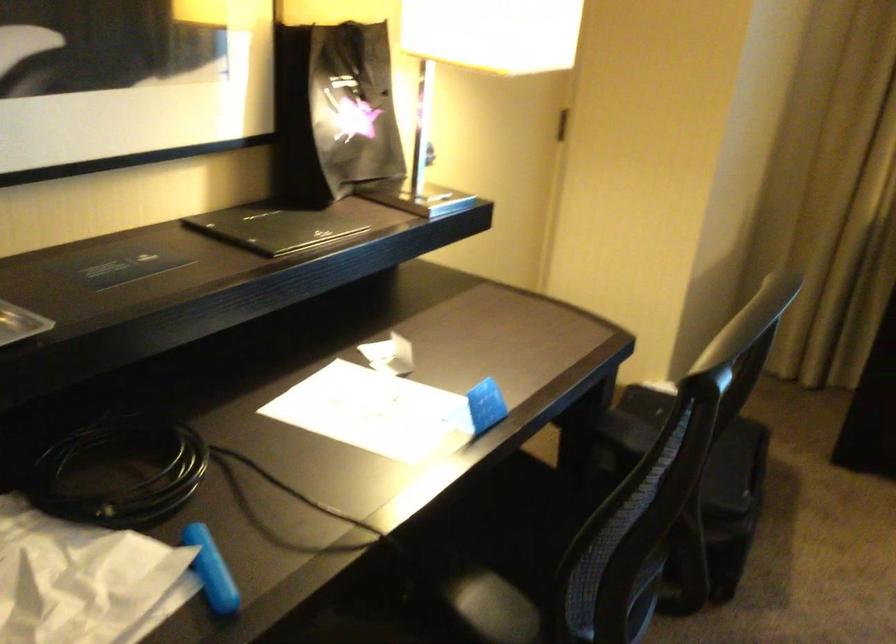
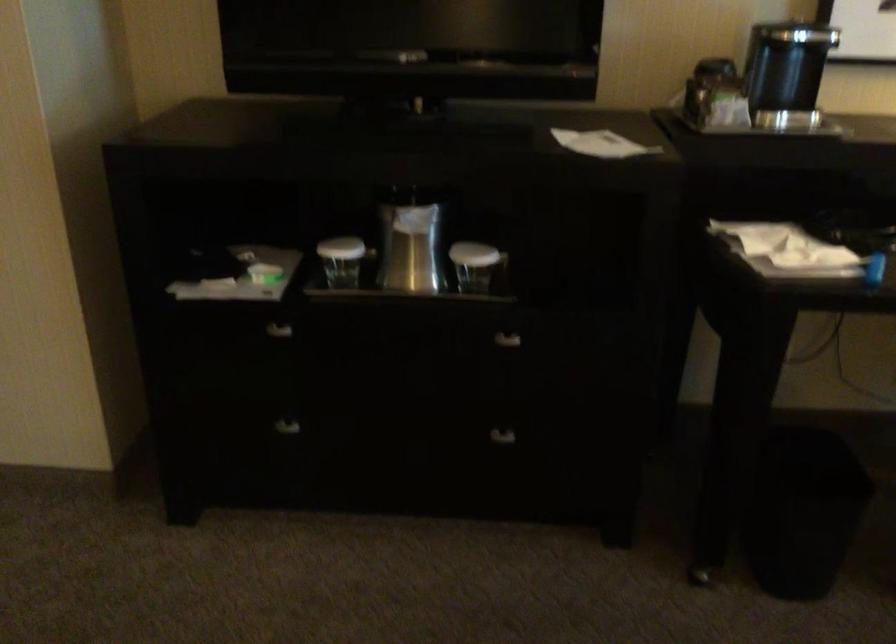
Question: The first image is from the beginning of the video and the second image is from the end. How did the camera likely rotate when shooting the video?

Choices:
 (A) Left
 (B) Right
 (C) Up
 (D) Down

Answer: (A)